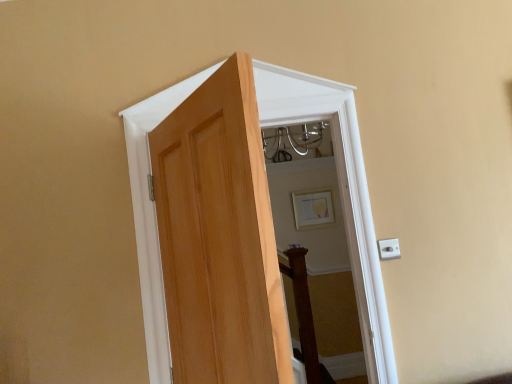
Question: Is white plastic electric outlet at right placed right next to matte gold picture frame at upper center?

Choices:
 (A) no
 (B) yes

Answer: (A)

Question: Considering the relative sizes of white plastic electric outlet at right and matte gold picture frame at upper center in the image provided, is white plastic electric outlet at right smaller than matte gold picture frame at upper center?

Choices:
 (A) no
 (B) yes

Answer: (B)

Question: From the image's perspective, would you say white plastic electric outlet at right is positioned over matte gold picture frame at upper center?

Choices:
 (A) yes
 (B) no

Answer: (B)

Question: From a real-world perspective, is white plastic electric outlet at right physically above matte gold picture frame at upper center?

Choices:
 (A) no
 (B) yes

Answer: (A)

Question: Is white plastic electric outlet at right to the left of matte gold picture frame at upper center from the viewer's perspective?

Choices:
 (A) no
 (B) yes

Answer: (B)

Question: Is natural wood door at center in front of or behind matte gold picture frame at upper center in the image?

Choices:
 (A) behind
 (B) front

Answer: (B)

Question: From a real-world perspective, is natural wood door at center above or below matte gold picture frame at upper center?

Choices:
 (A) below
 (B) above

Answer: (A)

Question: Looking at the image, does natural wood door at center seem bigger or smaller compared to matte gold picture frame at upper center?

Choices:
 (A) small
 (B) big

Answer: (B)

Question: Is natural wood door at center spatially inside matte gold picture frame at upper center, or outside of it?

Choices:
 (A) inside
 (B) outside

Answer: (B)

Question: Is matte gold picture frame at upper center taller or shorter than natural wood door at center?

Choices:
 (A) short
 (B) tall

Answer: (A)

Question: From the image's perspective, relative to natural wood door at center, is matte gold picture frame at upper center above or below?

Choices:
 (A) above
 (B) below

Answer: (B)

Question: Looking at the image, does matte gold picture frame at upper center seem bigger or smaller compared to natural wood door at center?

Choices:
 (A) big
 (B) small

Answer: (B)

Question: Based on their positions, is matte gold picture frame at upper center located to the left or right of natural wood door at center?

Choices:
 (A) right
 (B) left

Answer: (A)

Question: Considering the positions of point (391, 248) and point (304, 205), is point (391, 248) closer or farther from the camera than point (304, 205)?

Choices:
 (A) farther
 (B) closer

Answer: (B)

Question: Considering the positions of white plastic electric outlet at right and matte gold picture frame at upper center in the image, is white plastic electric outlet at right bigger or smaller than matte gold picture frame at upper center?

Choices:
 (A) small
 (B) big

Answer: (A)